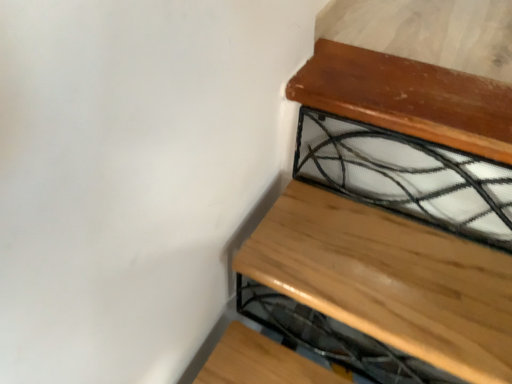
Question: Should I look upward or downward to see natural wood stair at upper right?

Choices:
 (A) up
 (B) down

Answer: (B)

Question: Is natural wood stair at upper right wider than clear glass at upper right?

Choices:
 (A) no
 (B) yes

Answer: (B)

Question: From a real-world perspective, does natural wood stair at upper right stand above clear glass at upper right?

Choices:
 (A) yes
 (B) no

Answer: (B)

Question: From the image's perspective, does natural wood stair at upper right appear lower than clear glass at upper right?

Choices:
 (A) yes
 (B) no

Answer: (A)

Question: From the image's perspective, is natural wood stair at upper right located above clear glass at upper right?

Choices:
 (A) no
 (B) yes

Answer: (A)

Question: Considering the relative sizes of natural wood stair at upper right and clear glass at upper right in the image provided, is natural wood stair at upper right taller than clear glass at upper right?

Choices:
 (A) no
 (B) yes

Answer: (A)

Question: Is natural wood stair at upper right not inside clear glass at upper right?

Choices:
 (A) no
 (B) yes

Answer: (B)

Question: Is clear glass at upper right turned away from natural wood stair at upper right?

Choices:
 (A) no
 (B) yes

Answer: (A)

Question: Is clear glass at upper right positioned behind natural wood stair at upper right?

Choices:
 (A) no
 (B) yes

Answer: (B)

Question: From the image's perspective, is clear glass at upper right beneath natural wood stair at upper right?

Choices:
 (A) yes
 (B) no

Answer: (B)

Question: Can you confirm if clear glass at upper right is thinner than natural wood stair at upper right?

Choices:
 (A) no
 (B) yes

Answer: (B)

Question: Considering the relative positions of clear glass at upper right and natural wood stair at upper right in the image provided, is clear glass at upper right to the left of natural wood stair at upper right from the viewer's perspective?

Choices:
 (A) no
 (B) yes

Answer: (A)

Question: Is clear glass at upper right surrounding natural wood stair at upper right?

Choices:
 (A) yes
 (B) no

Answer: (B)

Question: From a real-world perspective, is natural wood stair at upper right above or below clear glass at upper right?

Choices:
 (A) above
 (B) below

Answer: (B)